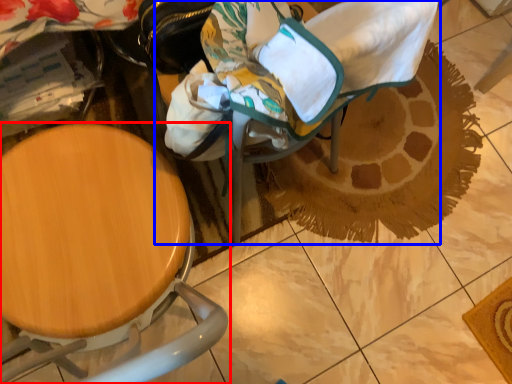
Question: Which point is closer to the camera, chair (highlighted by a red box) or baby carriage (highlighted by a blue box)?

Choices:
 (A) chair
 (B) baby carriage

Answer: (A)